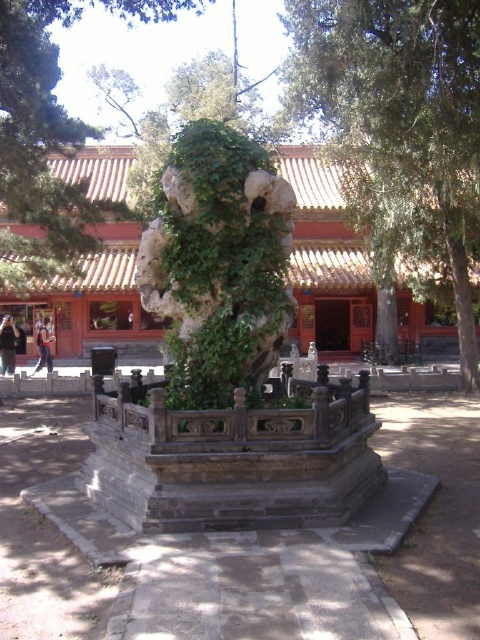
Question: Among these points, which one is farthest from the camera?

Choices:
 (A) click(x=309, y=72)
 (B) click(x=47, y=323)
 (C) click(x=263, y=364)

Answer: (B)

Question: Is green mossy stone statue at center to the right of dark blue jeans at lower left from the viewer's perspective?

Choices:
 (A) no
 (B) yes

Answer: (B)

Question: Which point is closer to the camera?

Choices:
 (A) (181, 182)
 (B) (424, 230)

Answer: (A)

Question: Which point is farther to the camera?

Choices:
 (A) green ivy-covered rock at center
 (B) denim jacket at lower left
 (C) dark blue jeans at lower left

Answer: (B)

Question: Is the position of green leafy tree at center less distant than that of dark blue jeans at lower left?

Choices:
 (A) yes
 (B) no

Answer: (A)

Question: Can you confirm if green leafy tree at center is positioned above green mossy stone statue at center?

Choices:
 (A) yes
 (B) no

Answer: (A)